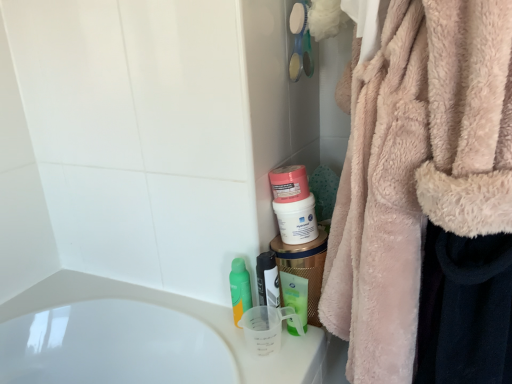
Question: Can you confirm if pink matte jar at center, placed as the third mouthwash when sorted from left to right, is shorter than fuzzy pink robe at right?

Choices:
 (A) no
 (B) yes

Answer: (B)

Question: Is fuzzy pink robe at right completely or partially inside pink matte jar at center, placed as the third mouthwash when sorted from left to right?

Choices:
 (A) no
 (B) yes

Answer: (A)

Question: Is there a large distance between pink matte jar at center, the 2th mouthwash viewed from the right, and fuzzy pink robe at right?

Choices:
 (A) yes
 (B) no

Answer: (B)

Question: Does pink matte jar at center, the 2th mouthwash viewed from the right, come in front of fuzzy pink robe at right?

Choices:
 (A) yes
 (B) no

Answer: (B)

Question: Could you tell me if pink matte jar at center, the 2th mouthwash viewed from the right, is facing fuzzy pink robe at right?

Choices:
 (A) no
 (B) yes

Answer: (A)

Question: Can you confirm if pink matte jar at center, the 2th mouthwash viewed from the right, is taller than fuzzy pink robe at right?

Choices:
 (A) no
 (B) yes

Answer: (A)

Question: Considering the relative sizes of pink matte jar at center, the 2th mouthwash viewed from the right, and green matte bottle at center, the 4th mouthwash in the right-to-left sequence, in the image provided, is pink matte jar at center, the 2th mouthwash viewed from the right, bigger than green matte bottle at center, the 4th mouthwash in the right-to-left sequence,?

Choices:
 (A) no
 (B) yes

Answer: (B)

Question: Considering the relative sizes of pink matte jar at center, the 2th mouthwash viewed from the right, and green matte bottle at center, the 4th mouthwash in the right-to-left sequence, in the image provided, is pink matte jar at center, the 2th mouthwash viewed from the right, thinner than green matte bottle at center, the 4th mouthwash in the right-to-left sequence,?

Choices:
 (A) no
 (B) yes

Answer: (A)

Question: Is pink matte jar at center, the 2th mouthwash viewed from the right, wider than green matte bottle at center, the 4th mouthwash in the right-to-left sequence?

Choices:
 (A) yes
 (B) no

Answer: (A)

Question: Is the depth of pink matte jar at center, placed as the third mouthwash when sorted from left to right, less than that of green matte bottle at center, the 4th mouthwash in the right-to-left sequence?

Choices:
 (A) yes
 (B) no

Answer: (A)

Question: Is pink matte jar at center, placed as the third mouthwash when sorted from left to right, surrounding green matte bottle at center, the 4th mouthwash in the right-to-left sequence?

Choices:
 (A) no
 (B) yes

Answer: (A)

Question: From a real-world perspective, is pink matte jar at center, the 2th mouthwash viewed from the right, physically above green matte bottle at center, the 4th mouthwash in the right-to-left sequence?

Choices:
 (A) no
 (B) yes

Answer: (B)

Question: Is pink matte jar at center, the 2th mouthwash viewed from the right, shorter than translucent plastic mouthwash at center, which is the 3th mouthwash in right-to-left order?

Choices:
 (A) yes
 (B) no

Answer: (A)